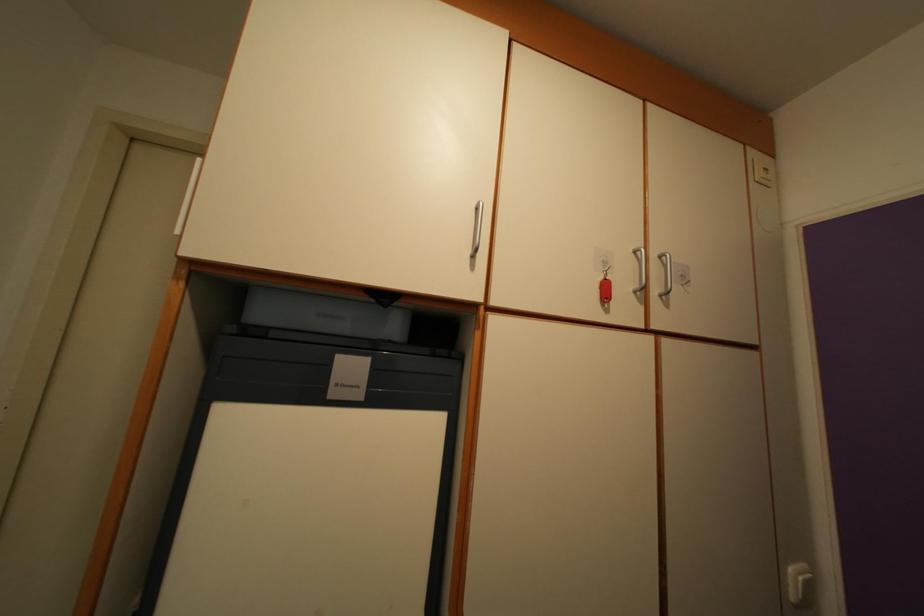
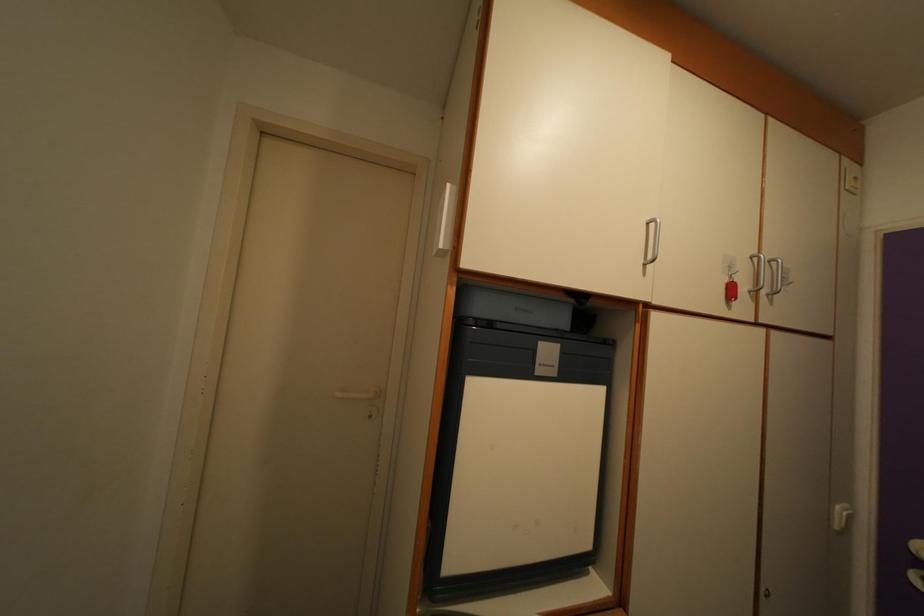
Question: The images are taken continuously from a first-person perspective. In which direction is your viewpoint rotating?

Choices:
 (A) Left
 (B) Right
 (C) Up
 (D) Down

Answer: (D)